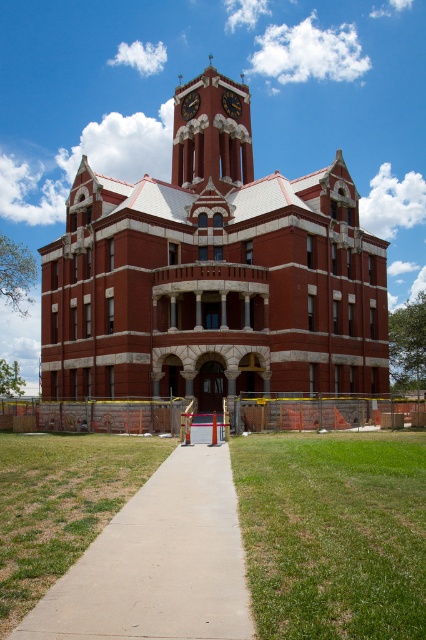
Does matte red brick clock tower at upper center appear on the right side of matte black clock at upper center?

In fact, matte red brick clock tower at upper center is to the left of matte black clock at upper center.

Can you confirm if matte red brick clock tower at upper center is thinner than matte black clock at upper center?

In fact, matte red brick clock tower at upper center might be wider than matte black clock at upper center.

Who is more distant from viewer, (230, 125) or (227, 99)?

The point (227, 99) is more distant.

The height and width of the screenshot is (640, 426). In order to click on matte red brick clock tower at upper center in this screenshot , I will do `click(212, 131)`.

Is red brick tower at center to the left of gold metallic clock at upper center from the viewer's perspective?

In fact, red brick tower at center is to the right of gold metallic clock at upper center.

At what (x,y) coordinates should I click in order to perform the action: click on red brick tower at center. Please return your answer as a coordinate pair (x, y). Looking at the image, I should click on 213,275.

Who is positioned more to the left, matte red brick clock tower at upper center or gold metallic clock at upper center?

From the viewer's perspective, matte red brick clock tower at upper center appears more on the left side.

Can you confirm if matte red brick clock tower at upper center is positioned to the right of gold metallic clock at upper center?

No, matte red brick clock tower at upper center is not to the right of gold metallic clock at upper center.

Find the location of a particular element. The image size is (426, 640). matte red brick clock tower at upper center is located at coordinates (212, 131).